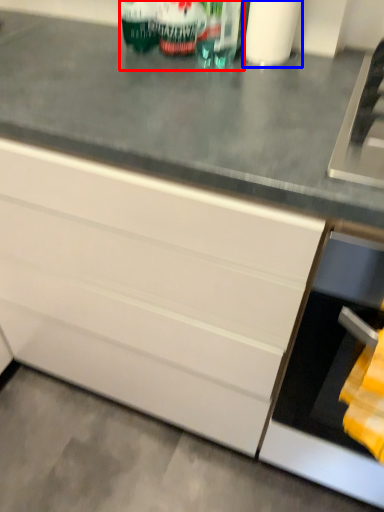
Question: Which of the following is the closest to the observer, beverage (highlighted by a red box) or toilet paper (highlighted by a blue box)?

Choices:
 (A) beverage
 (B) toilet paper

Answer: (B)